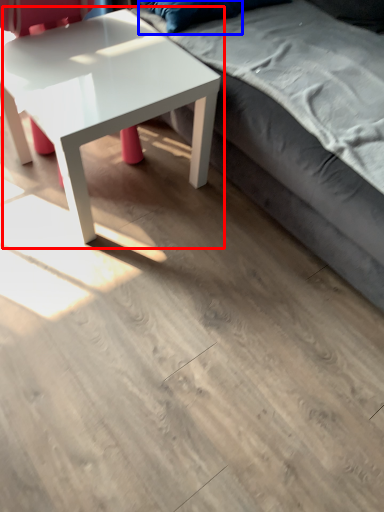
Question: Which of the following is the closest to the observer, coffee table (highlighted by a red box) or pillow (highlighted by a blue box)?

Choices:
 (A) coffee table
 (B) pillow

Answer: (A)